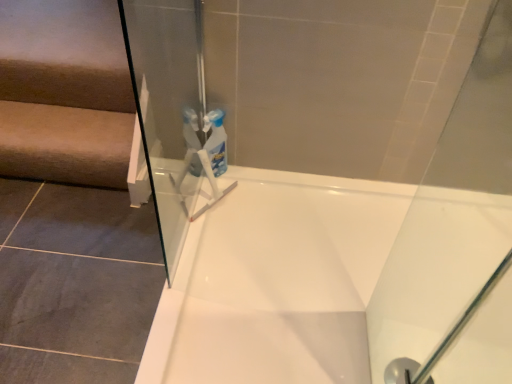
Find the location of a particular element. The width and height of the screenshot is (512, 384). vacant area that is situated to the right of transparent glass shower at lower right is located at coordinates (466, 362).